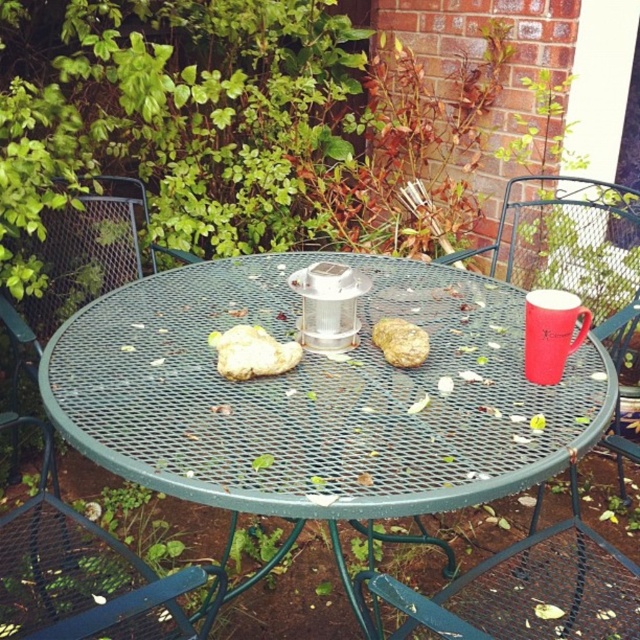
Who is higher up, red matte mug at right or brown crumbly bread at center?

red matte mug at right

Is point (554, 365) positioned in front of point (404, 337)?

Yes, point (554, 365) is in front of point (404, 337).

The width and height of the screenshot is (640, 640). I want to click on red matte mug at right, so click(x=552, y=332).

Is the position of green mesh table at center more distant than that of green metal chair at lower left?

Yes.

Is green mesh table at center positioned in front of green metal chair at lower left?

No, it is not.

Is point (205, 451) closer to viewer compared to point (49, 435)?

Yes, it is.

The height and width of the screenshot is (640, 640). Find the location of `green mesh table at center`. green mesh table at center is located at coordinates (320, 394).

Who is shorter, metal mesh chair at right or brown crumbly bread at center?

brown crumbly bread at center

Between metal mesh chair at right and brown crumbly bread at center, which one appears on the left side from the viewer's perspective?

brown crumbly bread at center

Is point (557, 220) closer to camera compared to point (404, 346)?

No, it is not.

Where is `metal mesh chair at right`? The width and height of the screenshot is (640, 640). metal mesh chair at right is located at coordinates (572, 250).